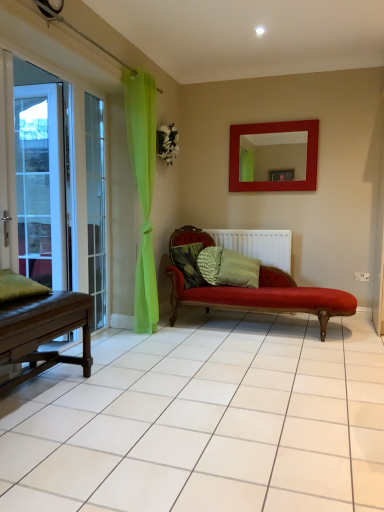
You are a GUI agent. You are given a task and a screenshot of the screen. Output one action in this format:
    pyautogui.click(x=<x>, y=<y>)
    Task: Click on the white glass screen door at left
    The image size is (384, 512).
    Given the screenshot: What is the action you would take?
    pyautogui.click(x=42, y=176)

In order to click on clear glass door at left in this screenshot , I will do `click(96, 207)`.

This screenshot has width=384, height=512. I want to click on green fabric pillow at left, which is the 4th pillow from right to left, so click(19, 286).

Identify the location of textured green pillow at center, acting as the third pillow starting from the back. (188, 263).

Locate an element on the screen. The image size is (384, 512). matte red mirror at upper center is located at coordinates click(274, 132).

Where is `white glass screen door at left`? Image resolution: width=384 pixels, height=512 pixels. white glass screen door at left is located at coordinates (42, 176).

Is point (11, 272) closer or farther from the camera than point (193, 249)?

Clearly, point (11, 272) is closer to the camera than point (193, 249).

Is green fabric pillow at left, placed as the fourth pillow when sorted from back to front, far from textured green pillow at center, the 2th pillow positioned from the front?

green fabric pillow at left, placed as the fourth pillow when sorted from back to front, is far away from textured green pillow at center, the 2th pillow positioned from the front.

Which of these two, green fabric pillow at left, marked as the first pillow in a left-to-right arrangement, or textured green pillow at center, which ranks as the second pillow in left-to-right order, is thinner?

Thinner between the two is textured green pillow at center, which ranks as the second pillow in left-to-right order.

How many degrees apart are the facing directions of green fabric pillow at left, placed as the first pillow when sorted from front to back, and textured green pillow at center, placed as the 3th pillow when sorted from right to left?

13.4 degrees separate the facing orientations of green fabric pillow at left, placed as the first pillow when sorted from front to back, and textured green pillow at center, placed as the 3th pillow when sorted from right to left.

Considering the sizes of objects textured green pillow at center, arranged as the 3th pillow when viewed from the left, and white matte radiator at center in the image provided, who is thinner, textured green pillow at center, arranged as the 3th pillow when viewed from the left, or white matte radiator at center?

With smaller width is white matte radiator at center.

At what (x,y) coordinates should I click in order to perform the action: click on the 3rd pillow directly beneath the white matte radiator at center (from a real-world perspective). Please return your answer as a coordinate pair (x, y). This screenshot has width=384, height=512. Looking at the image, I should click on (209, 264).

Is textured green pillow at center, which is the 1th pillow from back to front, taller than white matte radiator at center?

No, textured green pillow at center, which is the 1th pillow from back to front, is not taller than white matte radiator at center.

Consider the image. Is white matte radiator at center taller or shorter than green fabric pillow at left, which is the 4th pillow from right to left?

Clearly, white matte radiator at center is taller compared to green fabric pillow at left, which is the 4th pillow from right to left.

From the image's perspective, between white matte radiator at center and green fabric pillow at left, placed as the first pillow when sorted from front to back, who is located below?

green fabric pillow at left, placed as the first pillow when sorted from front to back, appears lower in the image.

Would you say white matte radiator at center is inside or outside green fabric pillow at left, placed as the fourth pillow when sorted from back to front?

white matte radiator at center is not inside green fabric pillow at left, placed as the fourth pillow when sorted from back to front, it's outside.

Can you confirm if white matte radiator at center is positioned to the right of green fabric pillow at left, marked as the first pillow in a left-to-right arrangement?

Indeed, white matte radiator at center is positioned on the right side of green fabric pillow at left, marked as the first pillow in a left-to-right arrangement.

Is textured green pillow at center, placed as the second pillow when sorted from right to left, at the back of green textured pillow at center, the second pillow from the back?

green textured pillow at center, the second pillow from the back, is not turned away from textured green pillow at center, placed as the second pillow when sorted from right to left.

Image resolution: width=384 pixels, height=512 pixels. I want to click on the 1st pillow located above the textured green pillow at center, arranged as the 3th pillow when viewed from the left (from a real-world perspective), so click(238, 270).

Considering the positions of points (223, 274) and (197, 257), is point (223, 274) farther from camera compared to point (197, 257)?

No, it is not.

Can you confirm if green textured pillow at center, the second pillow from the back, is thinner than matte red mirror at upper center?

In fact, green textured pillow at center, the second pillow from the back, might be wider than matte red mirror at upper center.

Measure the distance from green textured pillow at center, the second pillow from the back, to matte red mirror at upper center.

green textured pillow at center, the second pillow from the back, is 3.53 feet from matte red mirror at upper center.

Which of these two, green textured pillow at center, the first pillow when ordered from right to left, or matte red mirror at upper center, is bigger?

green textured pillow at center, the first pillow when ordered from right to left, is bigger.

Can you confirm if green textured pillow at center, the fourth pillow in the left-to-right sequence, is taller than matte red mirror at upper center?

Incorrect, the height of green textured pillow at center, the fourth pillow in the left-to-right sequence, is not larger of that of matte red mirror at upper center.

Looking at the image, does white glass screen door at left seem bigger or smaller compared to textured green pillow at center, which ranks as the second pillow in left-to-right order?

white glass screen door at left is bigger than textured green pillow at center, which ranks as the second pillow in left-to-right order.

Does white glass screen door at left turn towards textured green pillow at center, the 2th pillow positioned from the front?

No, white glass screen door at left is not oriented towards textured green pillow at center, the 2th pillow positioned from the front.

Between white glass screen door at left and textured green pillow at center, the 2th pillow positioned from the front, which one has less height?

textured green pillow at center, the 2th pillow positioned from the front, is shorter.

Is the depth of white glass screen door at left less than that of textured green pillow at center, which ranks as the second pillow in left-to-right order?

Yes, it is.

Is the surface of textured green pillow at center, placed as the 3th pillow when sorted from right to left, in direct contact with brown leather bench at left?

They are not placed beside each other.

Which point is more distant from viewer, [195,267] or [27,320]?

The point [195,267] is more distant.

From a real-world perspective, between textured green pillow at center, acting as the third pillow starting from the back, and brown leather bench at left, who is vertically lower?

In real-world perspective, brown leather bench at left is lower.

From the image's perspective, who appears lower, textured green pillow at center, the 2th pillow positioned from the front, or brown leather bench at left?

brown leather bench at left appears lower in the image.

At what (x,y) coordinates should I click in order to perform the action: click on pillow that appears on the left of textured green pillow at center, acting as the third pillow starting from the back. Please return your answer as a coordinate pair (x, y). Looking at the image, I should click on (19, 286).

At what (x,y) coordinates should I click in order to perform the action: click on the 1st pillow in front of the white matte radiator at center. Please return your answer as a coordinate pair (x, y). The width and height of the screenshot is (384, 512). Looking at the image, I should click on (209, 264).

Which object lies nearer to the anchor point white glass screen door at left, white matte radiator at center or matte red mirror at upper center?

white matte radiator at center lies closer to white glass screen door at left than the other object.

From the image, which object appears to be nearer to textured green pillow at center, the 2th pillow positioned from the front, matte red mirror at upper center or green textured pillow at center, the second pillow from the back?

The object closer to textured green pillow at center, the 2th pillow positioned from the front, is green textured pillow at center, the second pillow from the back.

Estimate the real-world distances between objects in this image. Which object is closer to white glass screen door at left, brown leather bench at left or textured green pillow at center, acting as the third pillow starting from the back?

The object closer to white glass screen door at left is textured green pillow at center, acting as the third pillow starting from the back.

From the picture: When comparing their distances from white glass screen door at left, does textured green pillow at center, which is the fourth pillow from front to back, or textured green pillow at center, placed as the 3th pillow when sorted from right to left, seem further?

textured green pillow at center, which is the fourth pillow from front to back, lies further to white glass screen door at left than the other object.

From the picture: When comparing their distances from textured green pillow at center, placed as the 3th pillow when sorted from right to left, does brown leather bench at left or clear glass door at left seem further?

brown leather bench at left.

Looking at the image, which one is located further to white matte radiator at center, matte red mirror at upper center or brown leather bench at left?

The object further to white matte radiator at center is brown leather bench at left.

Which object lies further to the anchor point white glass screen door at left, textured green pillow at center, which is the fourth pillow from front to back, or green textured pillow at center, the first pillow when ordered from right to left?

green textured pillow at center, the first pillow when ordered from right to left, lies further to white glass screen door at left than the other object.

From the image, which object appears to be nearer to white glass screen door at left, green textured pillow at center, arranged as the 3th pillow when viewed from the front, or matte red mirror at upper center?

green textured pillow at center, arranged as the 3th pillow when viewed from the front, is closer to white glass screen door at left.

At what (x,y) coordinates should I click in order to perform the action: click on screen door between green fabric pillow at left, marked as the first pillow in a left-to-right arrangement, and green textured pillow at center, the fourth pillow in the left-to-right sequence, in the front-back direction. Please return your answer as a coordinate pair (x, y). Looking at the image, I should click on (42, 176).

Find the location of a particular element. Image resolution: width=384 pixels, height=512 pixels. window located between brown leather bench at left and textured green pillow at center, which ranks as the second pillow in left-to-right order, in the depth direction is located at coordinates (96, 207).

The width and height of the screenshot is (384, 512). What are the coordinates of `window between white glass screen door at left and textured green pillow at center, placed as the second pillow when sorted from right to left, from front to back` in the screenshot? It's located at (96, 207).

Find the location of a particular element. pillow between matte red mirror at upper center and green textured pillow at center, the second pillow from the back, vertically is located at coordinates (188, 263).